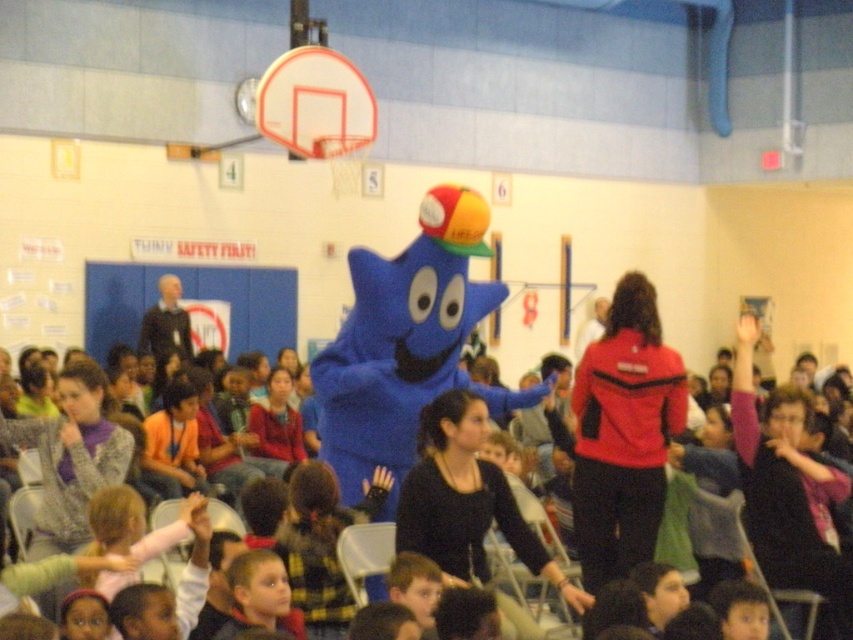
You are standing at the entrance of the gymnasium and want to approach the blue plush mascot at center. According to the coordinates provided, in which direction should you move from your current position to reach the mascot?

The blue plush mascot at center is located at coordinates point (399, 369), so you should move towards the center of the gymnasium from the entrance to reach it.

You are a student in the gym and want to grab the yellow rubber basketball at center without moving from your current position near the blue plush mascot at center. Can you reach it?

The distance between blue plush mascot at center and yellow rubber basketball at center is 3.37 feet. If the student can reach 3.37 feet or more, they can grab the basketball without moving. Otherwise, they need to step closer.